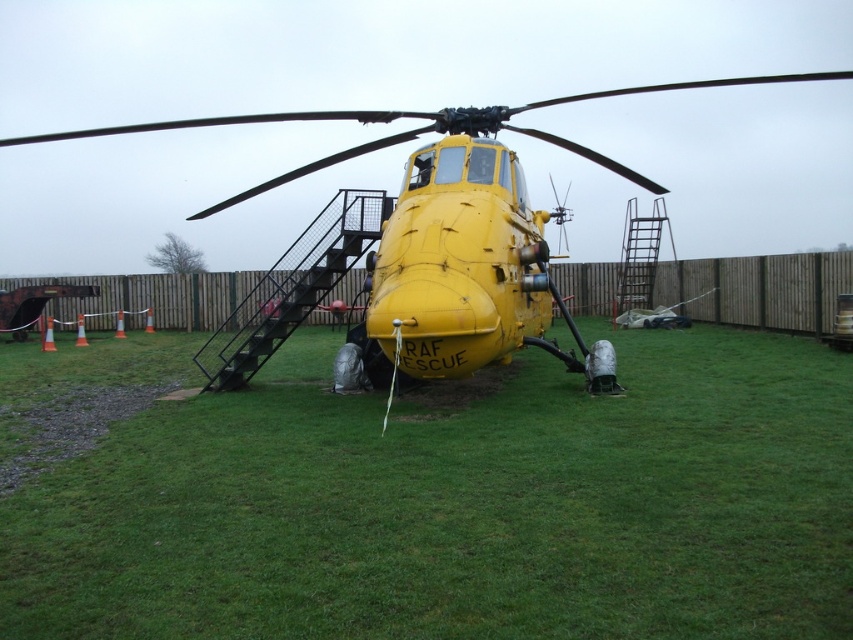
You are a photographer planning to take a wide shot of the yellow matte helicopter at center and the green grass at center. Based on the scene, which object will occupy more space in your photo?

The yellow matte helicopter at center will occupy more space in the photo because it is larger than the green grass at center according to the description.

You are a groundskeeper tasked with mowing the lawn around the yellow matte helicopter at center. Given that your lawnmower can only handle areas wider than the helicopter, will you be able to mow the green grass at center?

The green grass at center has a width less than the yellow matte helicopter at center, so the lawnmower cannot handle it since it requires areas wider than the helicopter. Therefore, you won won won won won won won won won won won won won won won won won won won won won won won won won won won won won won won won won won won won won won won won won won won won won won won won won won won won won won won won won won won won won won won won won won won won won won won won won won won won won won won won won n